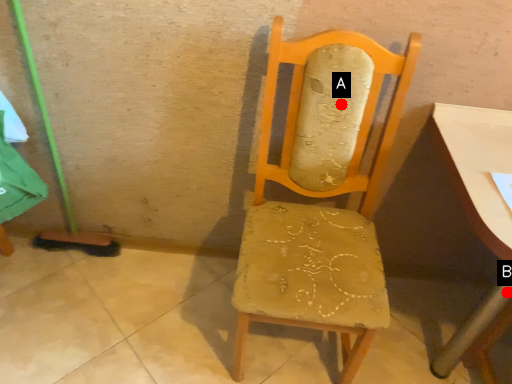
Question: Two points are circled on the image, labeled by A and B beside each circle. Which point is closer to the camera?

Choices:
 (A) A is closer
 (B) B is closer

Answer: (A)